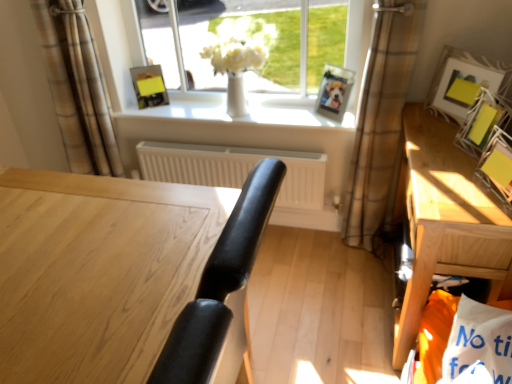
Locate an element on the screen. This screenshot has height=384, width=512. free space above white matte radiator at center (from a real-world perspective) is located at coordinates (233, 152).